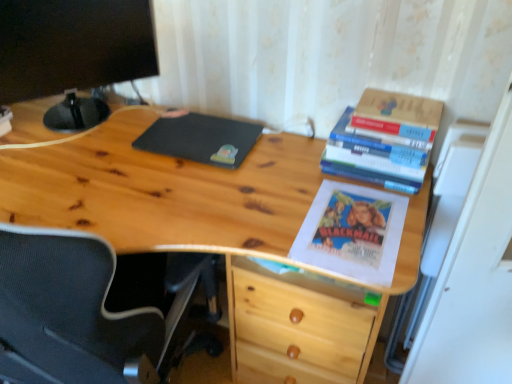
Identify the location of free location in front of black matte mousepad at center. (188, 192).